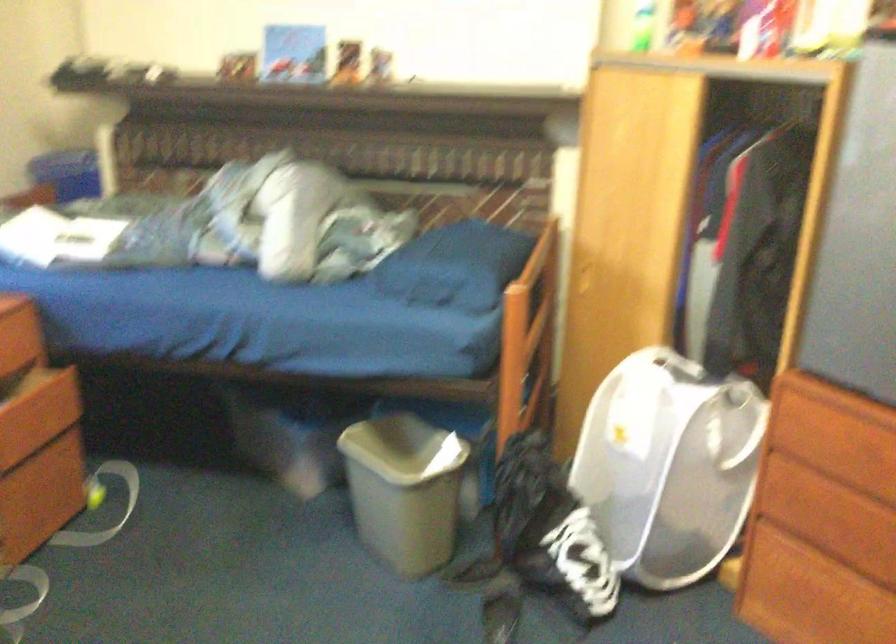
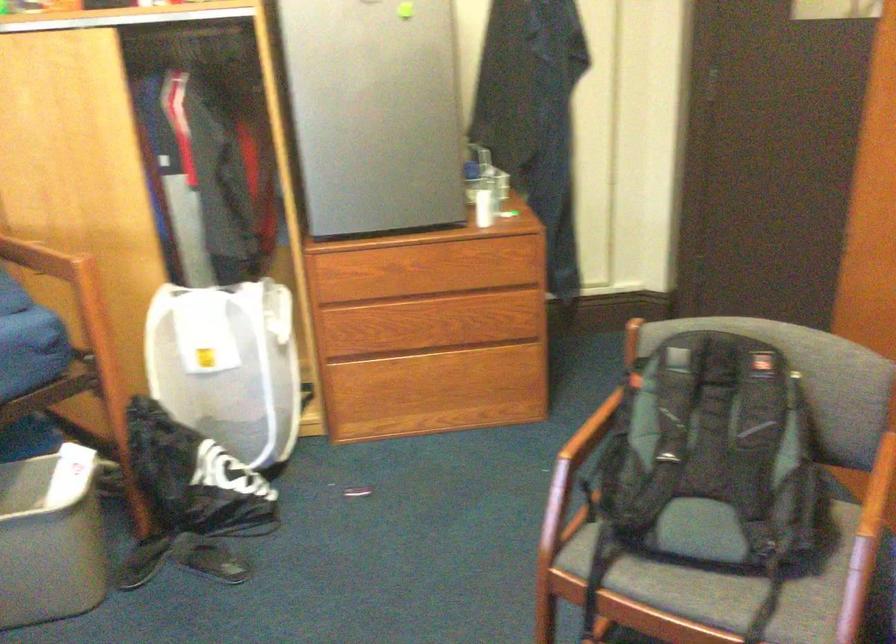
The point at (x=383, y=496) is marked in the first image. Where is the corresponding point in the second image?

(49, 538)